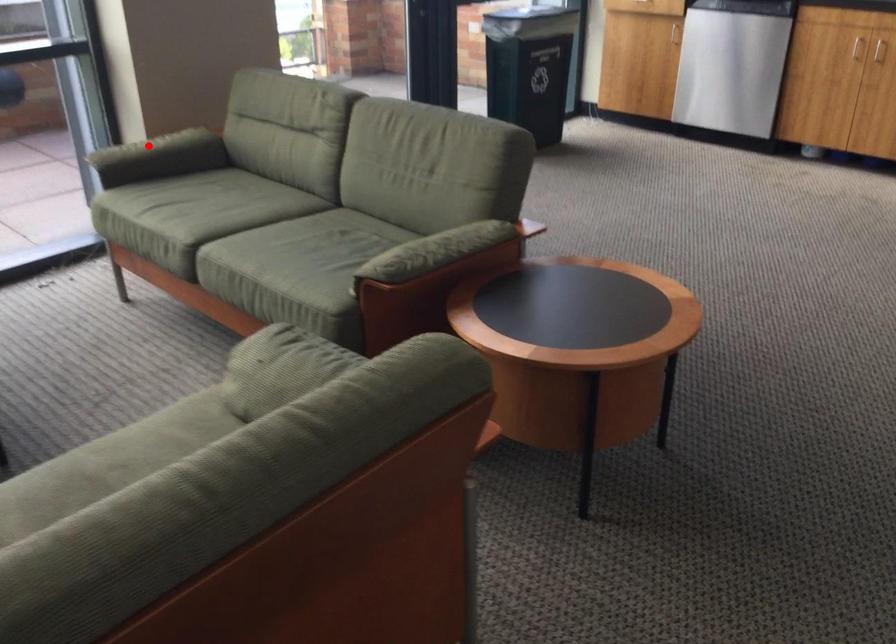
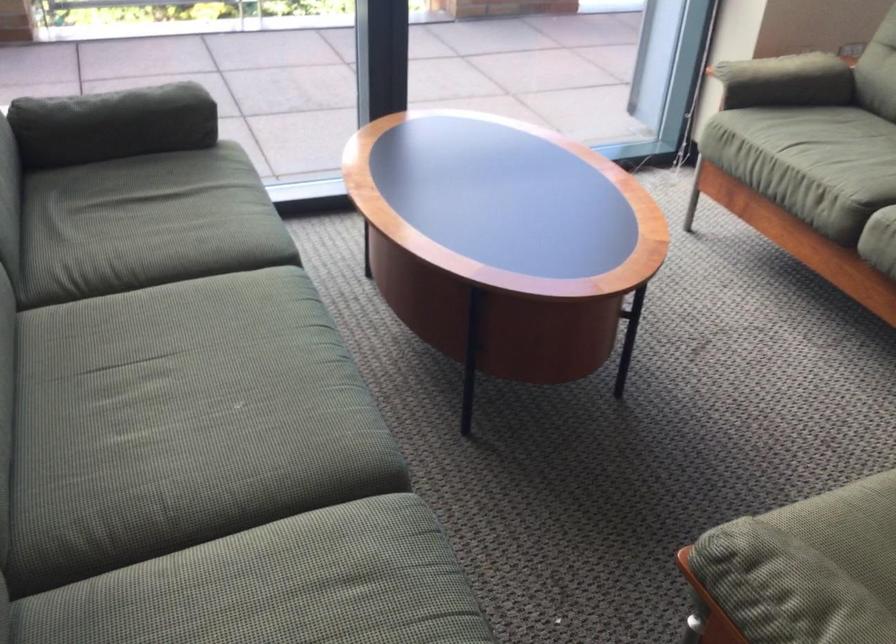
Locate, in the second image, the point that corresponds to the highlighted location in the first image.

(773, 68)